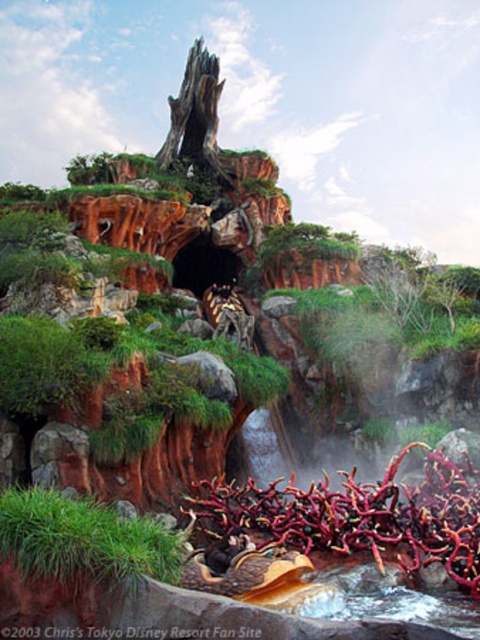
Can you confirm if rubberized red vines at lower center is wider than green grassy patch at lower left?

Indeed, rubberized red vines at lower center has a greater width compared to green grassy patch at lower left.

How much distance is there between rubberized red vines at lower center and green grassy patch at lower left?

A distance of 43.44 feet exists between rubberized red vines at lower center and green grassy patch at lower left.

In the scene shown: Who is more forward, (462,588) or (84,557)?

Point (84,557) is in front.

Where is `rubberized red vines at lower center`? This screenshot has width=480, height=640. rubberized red vines at lower center is located at coordinates (359, 516).